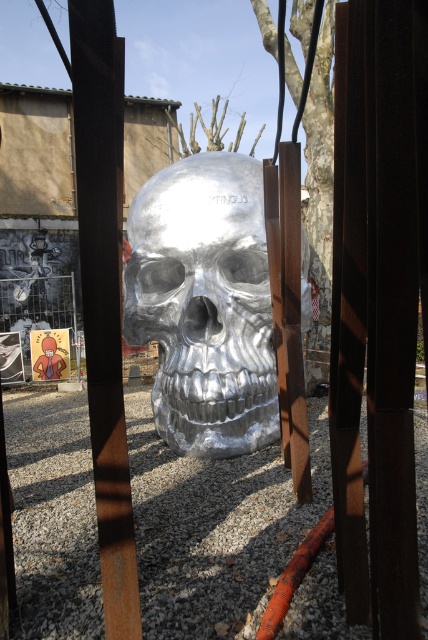
Question: Is rusty metal pole at center below brushed metal person at lower left?

Choices:
 (A) yes
 (B) no

Answer: (B)

Question: Which object is positioned closest to the shiny metallic skull at center?

Choices:
 (A) brushed metal fence at center
 (B) orange rubber hose at center
 (C) rusty metal pole at center

Answer: (B)

Question: Does rusty metal pole at center appear over brushed metal person at lower left?

Choices:
 (A) no
 (B) yes

Answer: (B)

Question: Which of these objects is positioned closest to the brushed metal person at lower left?

Choices:
 (A) orange rubber hose at center
 (B) rusty metal pole at center
 (C) brushed metal fence at center
 (D) shiny metallic skull at center

Answer: (C)

Question: Is rusty metal pole at center thinner than brushed metal person at lower left?

Choices:
 (A) no
 (B) yes

Answer: (B)

Question: Considering the real-world distances, which object is closest to the brushed metal person at lower left?

Choices:
 (A) rusty metal pole at center
 (B) brushed metal fence at center

Answer: (B)